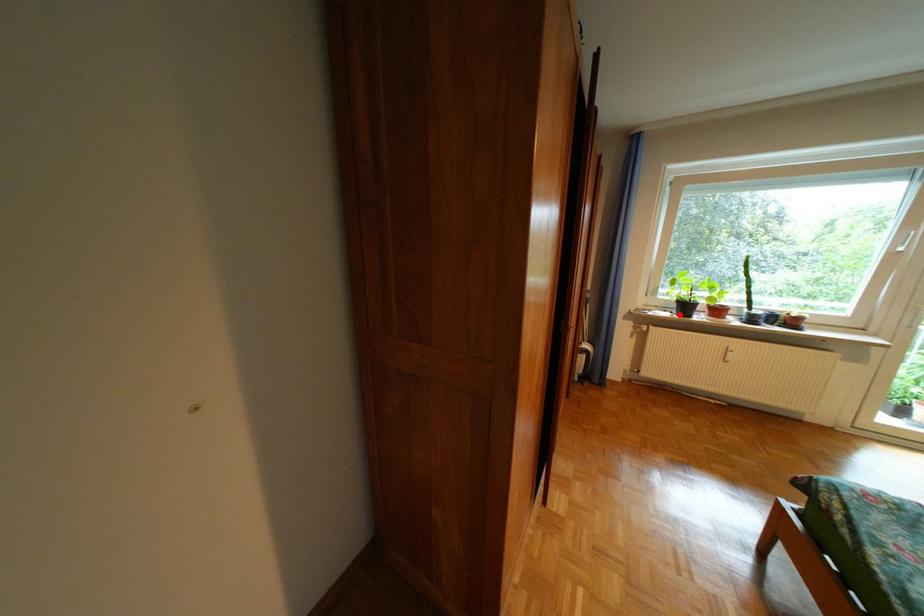
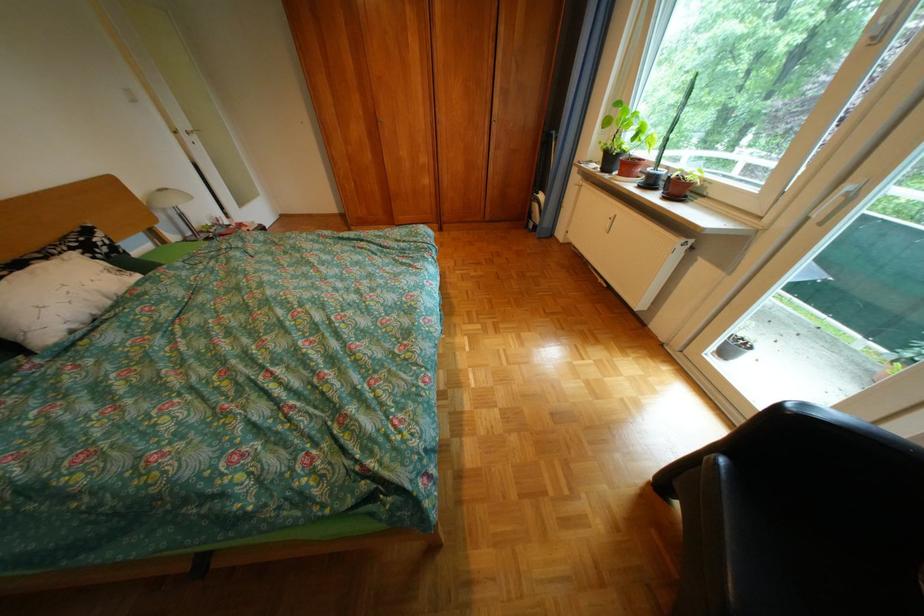
Question: I am providing you with two images of the same scene from different viewpoints. A red point is marked on the first image. Can you still see the location of the red point in image 2?

Choices:
 (A) Yes
 (B) No

Answer: (A)